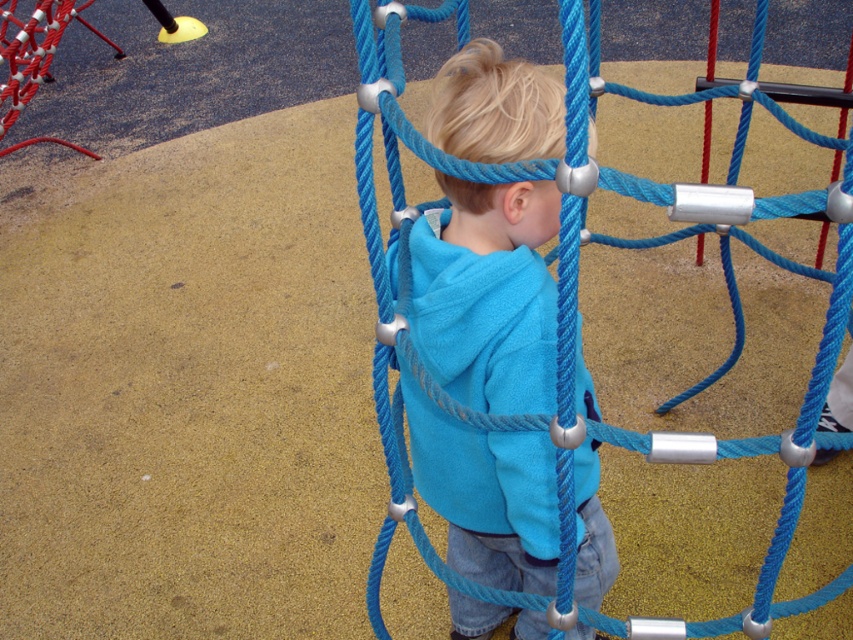
Question: Is blue fleece jacket at center smaller than blue rope net at center?

Choices:
 (A) no
 (B) yes

Answer: (B)

Question: Observing the image, what is the correct spatial positioning of blue fleece jacket at center in reference to blue rope net at center?

Choices:
 (A) above
 (B) below

Answer: (B)

Question: Is blue fleece jacket at center thinner than blue rope net at center?

Choices:
 (A) no
 (B) yes

Answer: (B)

Question: Which object appears closest to the camera in this image?

Choices:
 (A) blue rope net at center
 (B) blue fleece jacket at center

Answer: (A)